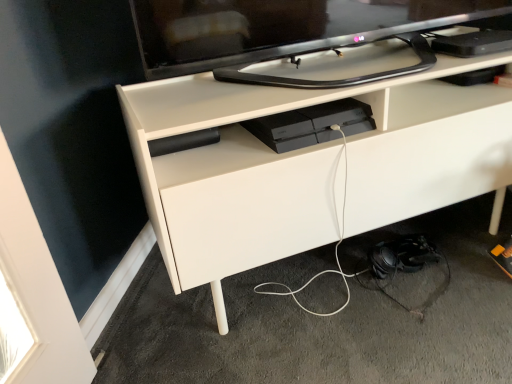
In order to click on white matte desk at center in this screenshot , I will do `click(309, 166)`.

In the scene shown: From the image's perspective, is black glossy tv at upper center above or below white matte desk at center?

Clearly, from the image's perspective, black glossy tv at upper center is above white matte desk at center.

Would you say black glossy tv at upper center is a long distance from white matte desk at center?

No, there isn't a large distance between black glossy tv at upper center and white matte desk at center.

Is black glossy tv at upper center to the left or to the right of white matte desk at center in the image?

black glossy tv at upper center is to the left of white matte desk at center.

Is black glossy tv at upper center completely or partially outside of white matte desk at center?

Yes.

Is point (216, 59) positioned behind point (348, 116)?

No, (216, 59) is in front of (348, 116).

Looking at this image, from the image's perspective, is black glossy tv at upper center over satin black console at center?

Yes.

Is black glossy tv at upper center directly adjacent to satin black console at center?

black glossy tv at upper center and satin black console at center are not in contact.

Is satin black console at center completely or partially inside black glossy tv at upper center?

No, satin black console at center is not a part of black glossy tv at upper center.

Considering the relative sizes of white matte cable at lower center and white matte desk at center in the image provided, is white matte cable at lower center wider than white matte desk at center?

Yes, white matte cable at lower center is wider than white matte desk at center.

At what (x,y) coordinates should I click in order to perform the action: click on desk above the white matte cable at lower center (from a real-world perspective). Please return your answer as a coordinate pair (x, y). The image size is (512, 384). Looking at the image, I should click on (309, 166).

Could you tell me if white matte cable at lower center is turned towards white matte desk at center?

No, white matte cable at lower center does not turn towards white matte desk at center.

Which is in front, point (343, 92) or point (349, 41)?

The point (343, 92) is in front.

Is white matte desk at center to the left or to the right of black glossy tv at upper center in the image?

In the image, white matte desk at center appears on the right side of black glossy tv at upper center.

From a real-world perspective, which object rests below the other?

From a 3D spatial view, white matte desk at center is below.

Considering the relative sizes of white matte desk at center and black glossy tv at upper center in the image provided, is white matte desk at center wider than black glossy tv at upper center?

Correct, the width of white matte desk at center exceeds that of black glossy tv at upper center.

From the image's perspective, is white matte cable at lower center located above satin black console at center?

No, from the image's perspective, white matte cable at lower center is not on top of satin black console at center.

How different are the orientations of white matte cable at lower center and satin black console at center in degrees?

60.4 degrees.

Is white matte cable at lower center inside the boundaries of satin black console at center, or outside?

white matte cable at lower center cannot be found inside satin black console at center.

From the image's perspective, which is below, black glossy tv at upper center or white matte cable at lower center?

white matte cable at lower center appears lower in the image.

From a real-world perspective, is black glossy tv at upper center located beneath white matte cable at lower center?

Actually, black glossy tv at upper center is physically above white matte cable at lower center in the real world.

Is black glossy tv at upper center not within white matte cable at lower center?

That's correct, black glossy tv at upper center is outside of white matte cable at lower center.

Looking at their sizes, would you say black glossy tv at upper center is wider or thinner than white matte cable at lower center?

In the image, black glossy tv at upper center appears to be more narrow than white matte cable at lower center.

From the image's perspective, is satin black console at center located beneath white matte desk at center?

No, from the image's perspective, satin black console at center is not beneath white matte desk at center.

How many degrees apart are the facing directions of satin black console at center and white matte desk at center?

The angular difference between satin black console at center and white matte desk at center is 0.756 degrees.

From a real-world perspective, who is located higher, satin black console at center or white matte desk at center?

satin black console at center, from a real-world perspective.

Is satin black console at center with white matte desk at center?

They are not placed beside each other.

Find the location of a particular element. television on the left side of white matte desk at center is located at coordinates (280, 28).

Image resolution: width=512 pixels, height=384 pixels. In order to click on television above the satin black console at center (from the image's perspective) in this screenshot , I will do `click(280, 28)`.

Estimate the real-world distances between objects in this image. Which object is further from white matte cable at lower center, satin black console at center or black glossy tv at upper center?

Based on the image, black glossy tv at upper center appears to be further to white matte cable at lower center.

From the image, which object appears to be nearer to white matte desk at center, satin black console at center or black glossy tv at upper center?

satin black console at center lies closer to white matte desk at center than the other object.

When comparing their distances from white matte desk at center, does white matte cable at lower center or black glossy tv at upper center seem further?

white matte cable at lower center is further to white matte desk at center.

When comparing their distances from satin black console at center, does white matte desk at center or white matte cable at lower center seem closer?

The object closer to satin black console at center is white matte desk at center.

Which object lies further to the anchor point black glossy tv at upper center, satin black console at center or white matte desk at center?

Based on the image, white matte desk at center appears to be further to black glossy tv at upper center.

Looking at the image, which one is located closer to black glossy tv at upper center, satin black console at center or white matte cable at lower center?

satin black console at center lies closer to black glossy tv at upper center than the other object.

Estimate the real-world distances between objects in this image. Which object is further from white matte cable at lower center, black glossy tv at upper center or satin black console at center?

black glossy tv at upper center is positioned further to the anchor white matte cable at lower center.

Looking at the image, which one is located further to white matte desk at center, white matte cable at lower center or satin black console at center?

Based on the image, white matte cable at lower center appears to be further to white matte desk at center.

Where is `equipment between black glossy tv at upper center and white matte desk at center in the up-down direction`? equipment between black glossy tv at upper center and white matte desk at center in the up-down direction is located at coordinates (311, 124).

Identify the location of desk between satin black console at center and white matte cable at lower center from top to bottom. The width and height of the screenshot is (512, 384). (309, 166).

Where is `desk between black glossy tv at upper center and white matte cable at lower center from top to bottom`? The width and height of the screenshot is (512, 384). desk between black glossy tv at upper center and white matte cable at lower center from top to bottom is located at coordinates (309, 166).

Locate an element on the screen. equipment between black glossy tv at upper center and white matte cable at lower center from top to bottom is located at coordinates (311, 124).